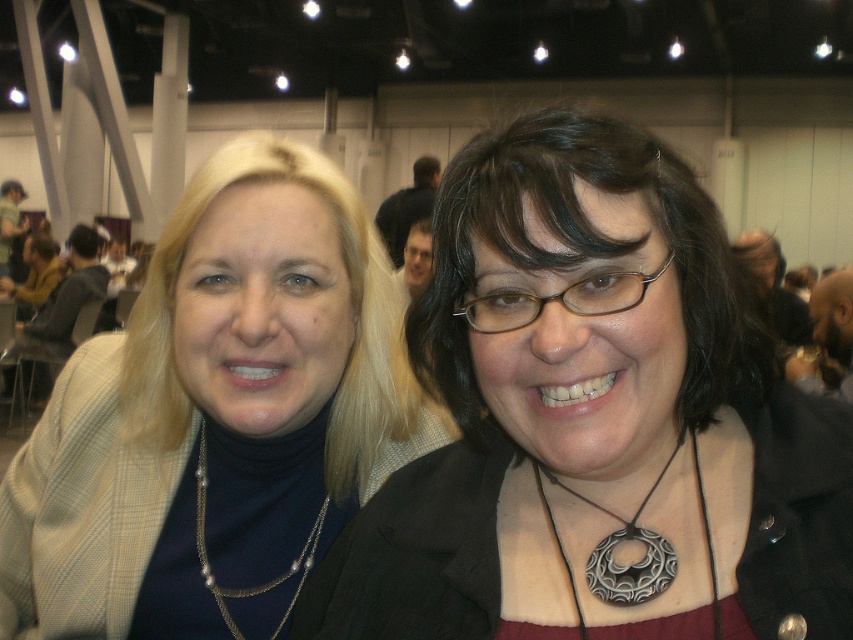
Question: From the image, what is the correct spatial relationship of black matte necklace at center in relation to matte gold jacket at left?

Choices:
 (A) right
 (B) left

Answer: (A)

Question: Which of the following is the closest to the observer?

Choices:
 (A) black matte necklace at center
 (B) matte gold jacket at left

Answer: (A)

Question: Which object appears closest to the camera in this image?

Choices:
 (A) black matte necklace at center
 (B) black matte pendant at center
 (C) pearl/gold chain necklace at center
 (D) matte gold jacket at left

Answer: (A)

Question: Is pearl/gold chain necklace at center to the left of black matte pendant at center from the viewer's perspective?

Choices:
 (A) no
 (B) yes

Answer: (B)

Question: Which object is positioned closest to the pearl/gold chain necklace at center?

Choices:
 (A) black matte pendant at center
 (B) matte gold jacket at left

Answer: (B)

Question: Does matte gold jacket at left appear under black matte pendant at center?

Choices:
 (A) no
 (B) yes

Answer: (B)